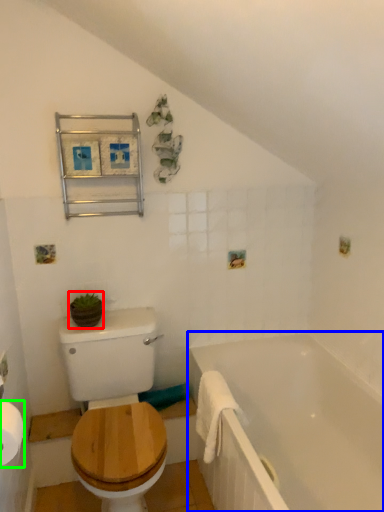
Question: Estimate the real-world distances between objects in this image. Which object is farther from plant (highlighted by a red box), bathtub (highlighted by a blue box) or toilet paper (highlighted by a green box)?

Choices:
 (A) bathtub
 (B) toilet paper

Answer: (A)